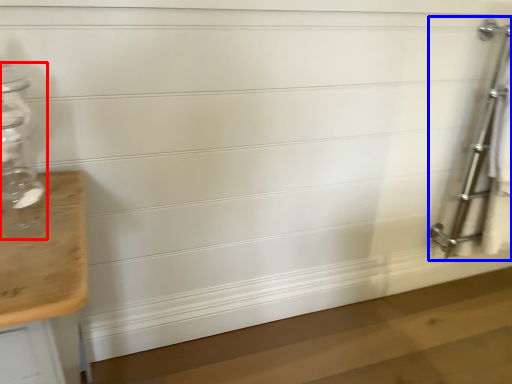
Question: Which point is closer to the camera, glass bottle (highlighted by a red box) or ladder (highlighted by a blue box)?

Choices:
 (A) glass bottle
 (B) ladder

Answer: (A)